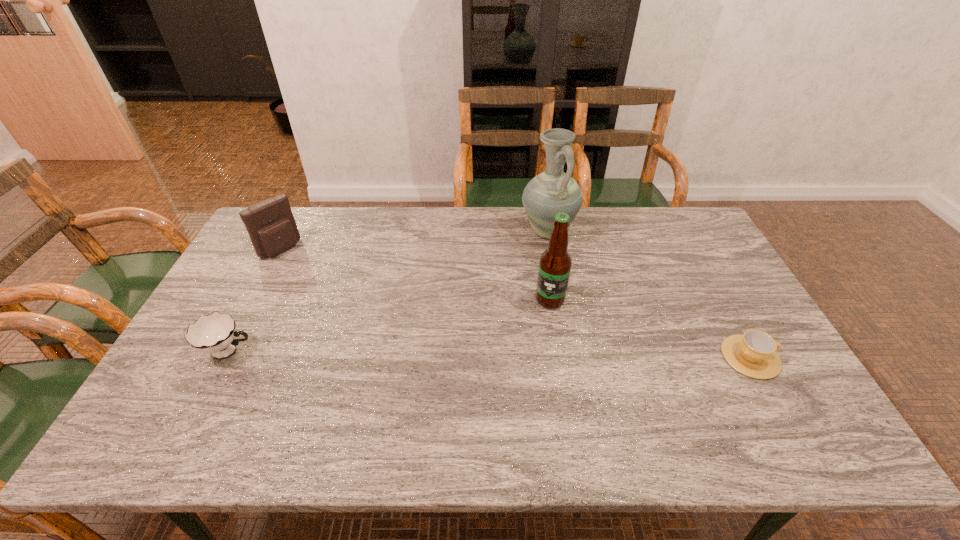
The height and width of the screenshot is (540, 960). I want to click on the left cup, so [215, 333].

This screenshot has height=540, width=960. Find the location of `the second shortest object`. the second shortest object is located at coordinates (215, 333).

I want to click on the right cup, so click(753, 354).

Locate an element on the screen. Image resolution: width=960 pixels, height=540 pixels. the shorter cup is located at coordinates (753, 354).

In order to click on pouch in this screenshot , I will do `click(272, 228)`.

Identify the location of beer bottle. This screenshot has width=960, height=540. (555, 263).

Locate an element on the screen. the third nearest object is located at coordinates (555, 263).

Image resolution: width=960 pixels, height=540 pixels. What are the coordinates of `the tallest object` in the screenshot? It's located at (553, 191).

You are a GUI agent. You are given a task and a screenshot of the screen. Output one action in this format:
    pyautogui.click(x=<x>, y=<y>)
    Task: Click on the vacant space located 0.100m on the side of the taller cup with the handle
    The height and width of the screenshot is (540, 960).
    Given the screenshot: What is the action you would take?
    pyautogui.click(x=295, y=352)

The image size is (960, 540). What are the coordinates of `blank space located with an open flap on the third tallest object` in the screenshot? It's located at (359, 311).